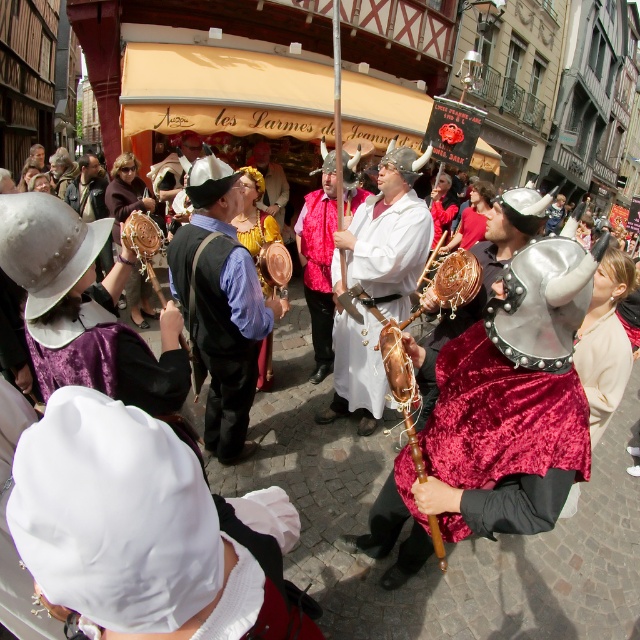
Which is behind, point (483, 422) or point (369, 400)?

The point (369, 400) is behind.

Who is more forward, (520, 291) or (353, 323)?

Point (520, 291) is in front.

Is point (477, 461) in front of point (346, 284)?

Yes, it is.

Find the location of a particular element. The height and width of the screenshot is (640, 640). velvet maroon skirt at center is located at coordinates (513, 380).

Can you confirm if white fabric robe at center is positioned above leather drum at center?

Incorrect, white fabric robe at center is not positioned above leather drum at center.

Does point (392, 276) come behind point (266, 337)?

That is False.

This screenshot has width=640, height=640. I want to click on white fabric robe at center, so click(x=376, y=282).

Is velvet red vest at center positioned at the back of gold textured crown at center?

No, it is in front of gold textured crown at center.

Who is more forward, (x=316, y=244) or (x=278, y=202)?

Point (x=316, y=244) is in front.

Between point (305, 214) and point (275, 168), which one is positioned in front?

Point (305, 214) is in front.

The height and width of the screenshot is (640, 640). In order to click on velvet red vest at center in this screenshot , I will do `click(317, 260)`.